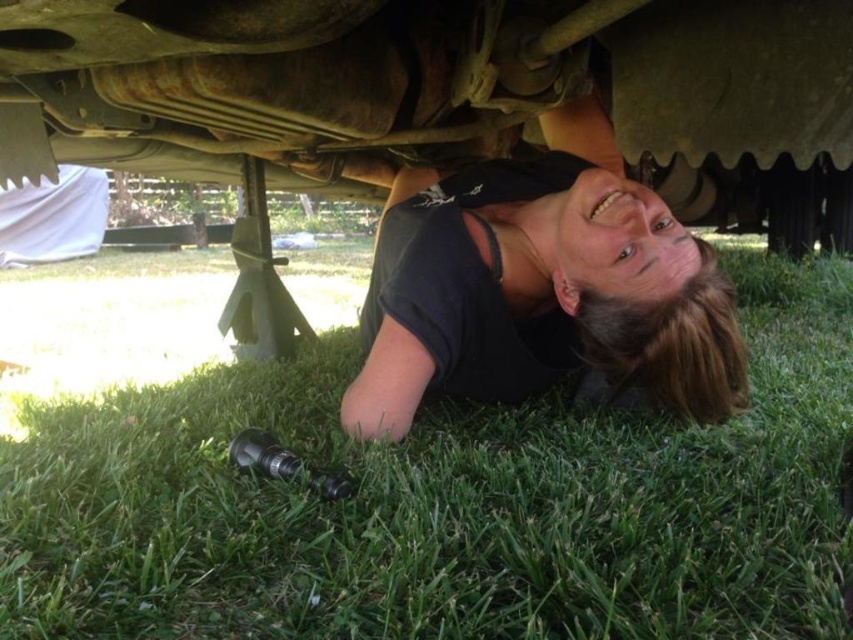
You are a mechanic working on a vehicle. You notice two points under the car, one at point coordinates point (x=848, y=292) and another at point (x=450, y=336). Which point is closer to your face while you are lying on the grass underneath the vehicle?

Point (x=450, y=336) is closer to your face because it is closer to the camera than point (x=848, y=292), which is further away.

You are a safety inspector checking the workspace of a mechanic working under a vehicle. You notice the green grass at lower center and the black matte shirt at lower center. Which object is closer to the ground?

The green grass at lower center is shorter than the black matte shirt at lower center, so the green grass at lower center is closer to the ground.